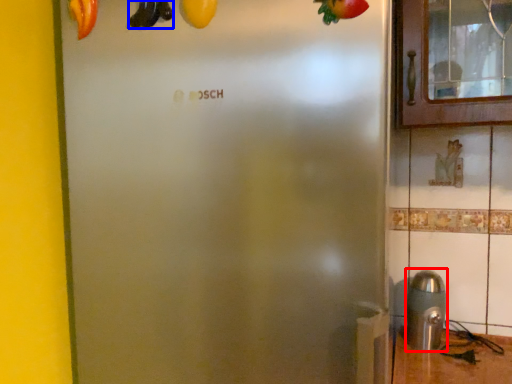
Question: Which of the following is the farthest to the observer, stainless steel (highlighted by a red box) or banana (highlighted by a blue box)?

Choices:
 (A) stainless steel
 (B) banana

Answer: (A)